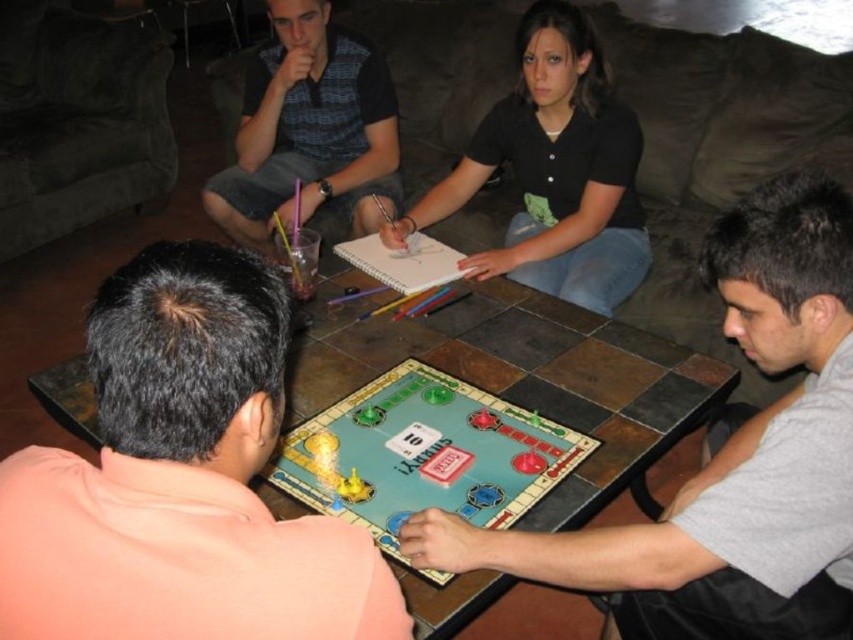
The width and height of the screenshot is (853, 640). What do you see at coordinates (521, 376) in the screenshot? I see `tile-patterned table at center` at bounding box center [521, 376].

Is tile-patterned table at center bigger than plaid shirt at upper center?

Yes.

Is point (669, 348) farther from viewer compared to point (325, 1)?

No, it is in front of (325, 1).

This screenshot has width=853, height=640. I want to click on tile-patterned table at center, so click(x=521, y=376).

Between point (653, 556) and point (260, 204), which one is positioned behind?

Point (260, 204)

Is point (595, 572) more distant than point (277, 100)?

No, it is in front of (277, 100).

The height and width of the screenshot is (640, 853). I want to click on gray fabric shirt at center, so click(x=730, y=458).

Does black matte shirt at center have a lesser width compared to plaid shirt at upper center?

Incorrect, black matte shirt at center's width is not less than plaid shirt at upper center's.

Based on the photo, who is taller, black matte shirt at center or plaid shirt at upper center?

black matte shirt at center is taller.

Locate an element on the screen. black matte shirt at center is located at coordinates (554, 170).